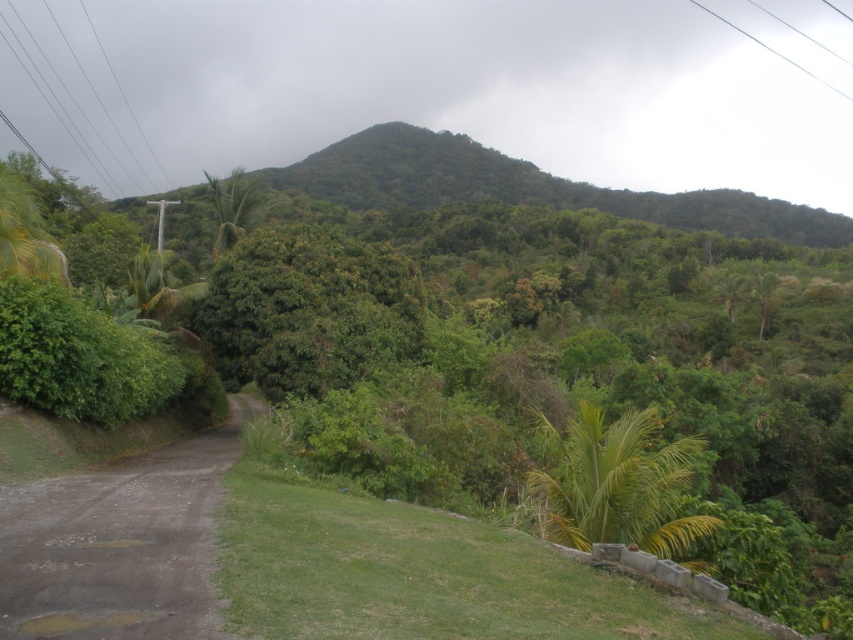
You are planning to take a photo of the green leafy mountain at center and the green leafy palm at center in the tropical landscape. Which object should you focus on first if you want to capture both in a single frame without moving the camera?

You should focus on the green leafy palm at center first because it is closer to the camera than the green leafy mountain at center, which is much taller and likely further away.

You are a hiker standing at the start of the dirt path in the image. You want to reach the green leafy mountain at center. Based on the distance provided, is the mountain within a 500 feet walking range?

The green leafy mountain at center is 497.88 feet away from camera, so yes, the mountain is within a 500 feet walking range since it is just under the limit.